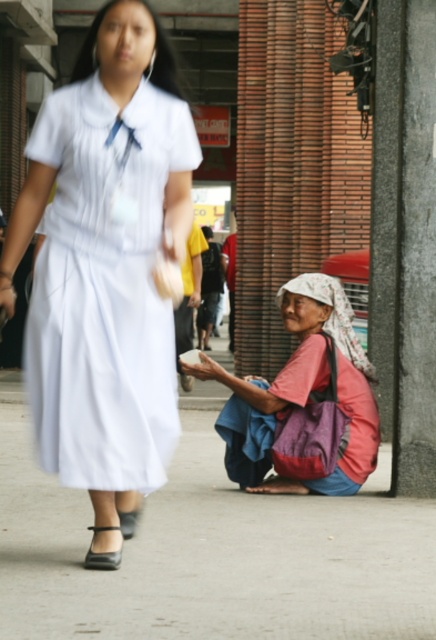
You are a photographer trying to capture a clear shot of the red fabric bag at lower right and the black leather sandal at lower left. Since the sandal is behind the bag, will it be visible in the photo?

The black leather sandal at lower left is behind the red fabric bag at lower right, so it might not be fully visible in the photo unless the bag is moved or the angle is adjusted.

You are a photographer standing in the middle of the street. You see the red fabric bag at lower right and the black leather sandal at lower left. Which object is closer to the camera?

The red fabric bag at lower right is located above the black leather sandal at lower left, so it is closer to the camera.